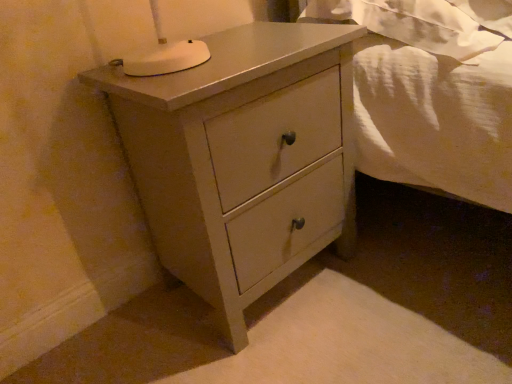
Question: Is point (313, 26) closer or farther from the camera than point (441, 23)?

Choices:
 (A) closer
 (B) farther

Answer: (B)

Question: From the image's perspective, relative to white cotton sheet at upper right, is matte gray chest of drawers at center above or below?

Choices:
 (A) below
 (B) above

Answer: (A)

Question: In terms of width, does matte gray chest of drawers at center look wider or thinner when compared to white cotton sheet at upper right?

Choices:
 (A) wide
 (B) thin

Answer: (B)

Question: Relative to matte gray chest of drawers at center, is white cotton sheet at upper right in front or behind?

Choices:
 (A) front
 (B) behind

Answer: (B)

Question: Does point (473, 18) appear closer or farther from the camera than point (228, 147)?

Choices:
 (A) closer
 (B) farther

Answer: (B)

Question: In terms of height, does white cotton sheet at upper right look taller or shorter compared to matte gray chest of drawers at center?

Choices:
 (A) tall
 (B) short

Answer: (B)

Question: From the image's perspective, relative to matte gray chest of drawers at center, is white cotton sheet at upper right above or below?

Choices:
 (A) below
 (B) above

Answer: (B)